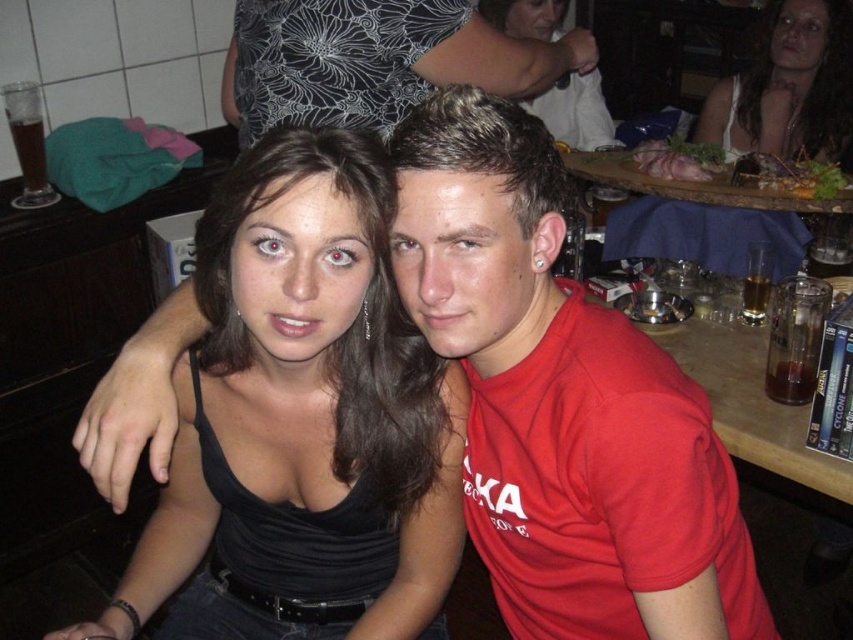
You are a photographer at the event and want to ensure both the black matte tank top at center and the white matte dress at upper right are visible in your photo. Which one should you position closer to the center of the frame to achieve this?

The black matte tank top at center is already positioned to the left of the white matte dress at upper right. To ensure both are visible, position the black matte tank top at center closer to the frame center since it is currently on the left side, allowing the white matte dress at upper right to also be included on the right side.

You are a photographer setting up for a group photo. You notice the black matte tank top at center and the white matte dress at upper right. Which of these two items is wider?

The black matte tank top at center is wider than the white matte dress at upper right.

You are a photographer trying to capture a photo of the black matte tank top at center and the white matte dress at upper right. Which object is located lower in the frame?

The black matte tank top at center is positioned under the white matte dress at upper right, so it is lower in the frame.